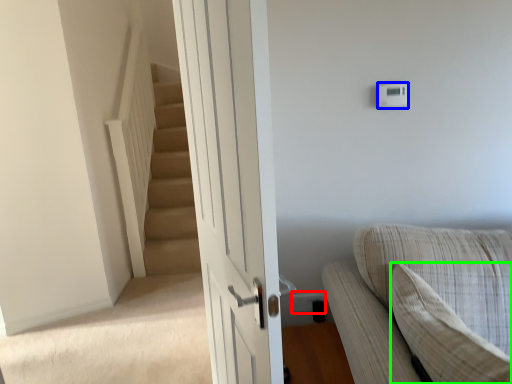
Question: Estimate the real-world distances between objects in this image. Which object is closer to electric outlet (highlighted by a red box), light switch (highlighted by a blue box) or pillow (highlighted by a green box)?

Choices:
 (A) light switch
 (B) pillow

Answer: (B)